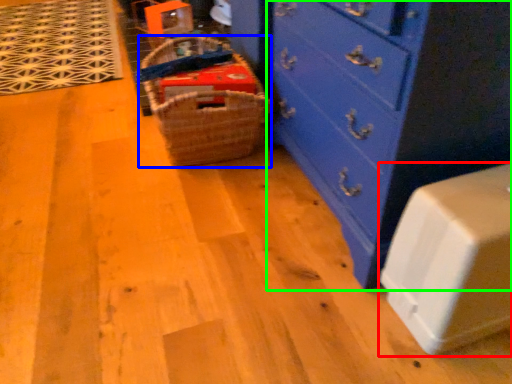
Question: Based on their relative distances, which object is nearer to cabinetry (highlighted by a red box)? Choose from basket (highlighted by a blue box) and chest of drawers (highlighted by a green box).

Choices:
 (A) basket
 (B) chest of drawers

Answer: (B)